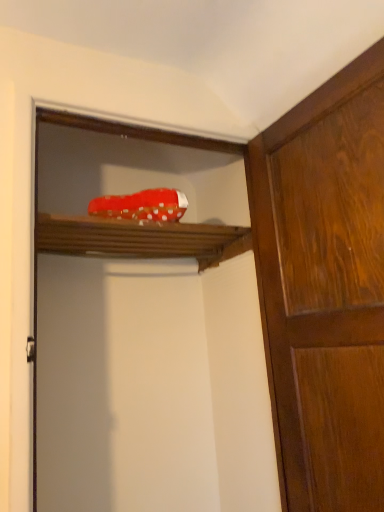
Question: From the image's perspective, would you say wooden shelf at upper center is shown under wooden cabinet at right?

Choices:
 (A) yes
 (B) no

Answer: (B)

Question: Is wooden cabinet at right located within wooden shelf at upper center?

Choices:
 (A) yes
 (B) no

Answer: (B)

Question: Is wooden shelf at upper center shorter than wooden cabinet at right?

Choices:
 (A) no
 (B) yes

Answer: (B)

Question: Is wooden shelf at upper center wider than wooden cabinet at right?

Choices:
 (A) no
 (B) yes

Answer: (B)

Question: Is wooden shelf at upper center beside wooden cabinet at right?

Choices:
 (A) no
 (B) yes

Answer: (A)

Question: From a real-world perspective, is wooden shelf at upper center located beneath wooden cabinet at right?

Choices:
 (A) yes
 (B) no

Answer: (B)

Question: Is red fabric shoe at upper center located within wooden cabinet at right?

Choices:
 (A) yes
 (B) no

Answer: (B)

Question: Does wooden cabinet at right have a larger size compared to red fabric shoe at upper center?

Choices:
 (A) yes
 (B) no

Answer: (B)

Question: Considering the relative positions of wooden cabinet at right and red fabric shoe at upper center in the image provided, is wooden cabinet at right to the right of red fabric shoe at upper center from the viewer's perspective?

Choices:
 (A) yes
 (B) no

Answer: (A)

Question: Is wooden cabinet at right taller than red fabric shoe at upper center?

Choices:
 (A) no
 (B) yes

Answer: (A)

Question: From the image's perspective, is wooden cabinet at right beneath red fabric shoe at upper center?

Choices:
 (A) no
 (B) yes

Answer: (A)

Question: From the image's perspective, is wooden cabinet at right over red fabric shoe at upper center?

Choices:
 (A) yes
 (B) no

Answer: (A)

Question: Does wooden shelf at upper center have a lesser width compared to red fabric shoe at upper center?

Choices:
 (A) yes
 (B) no

Answer: (B)